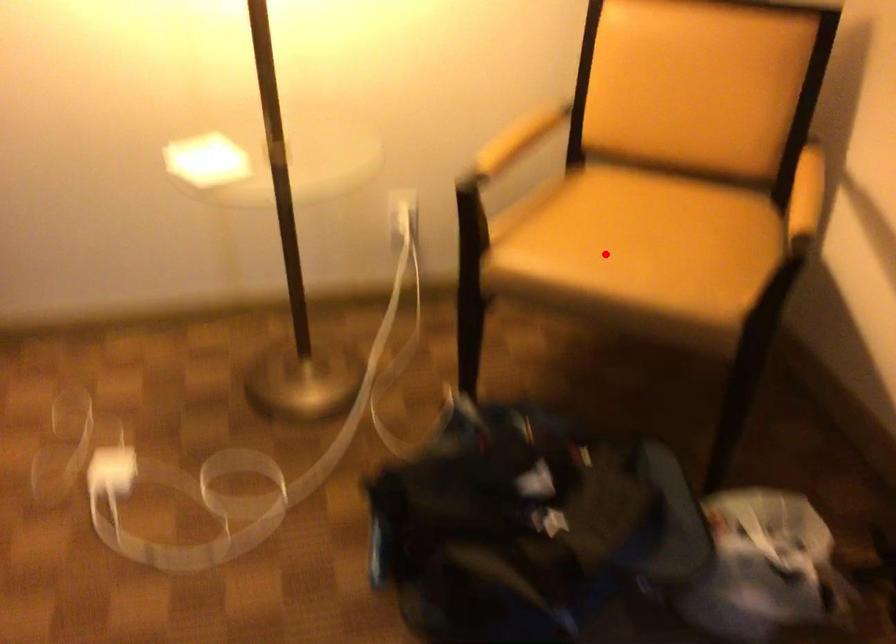
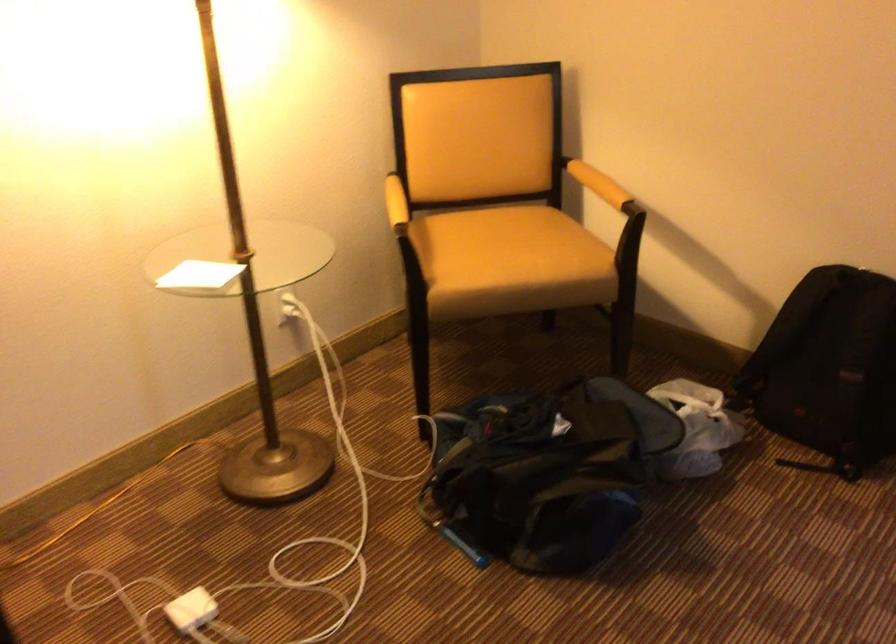
Question: I am providing you with two images of the same scene from different viewpoints. Image1 has a red point marked. In image2, the corresponding 3D location appears at what relative position? Reply with the corresponding letter.

Choices:
 (A) Closer
 (B) Farther

Answer: (B)